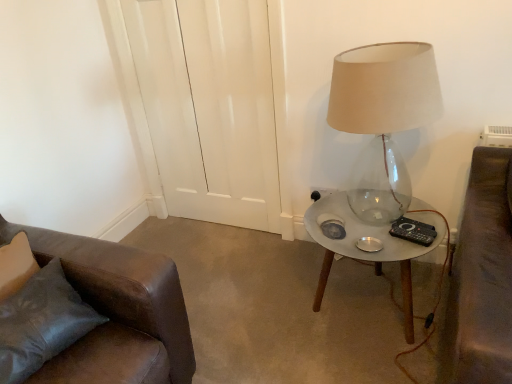
Question: Does black plastic remote control at right have a smaller size compared to black plastic socket at lower right?

Choices:
 (A) no
 (B) yes

Answer: (A)

Question: Is black plastic remote control at right closer to the viewer compared to black plastic socket at lower right?

Choices:
 (A) no
 (B) yes

Answer: (B)

Question: Is black plastic remote control at right not within black plastic socket at lower right?

Choices:
 (A) no
 (B) yes

Answer: (B)

Question: Is black plastic remote control at right next to black plastic socket at lower right and touching it?

Choices:
 (A) no
 (B) yes

Answer: (A)

Question: From the image's perspective, is black plastic remote control at right over black plastic socket at lower right?

Choices:
 (A) no
 (B) yes

Answer: (A)

Question: Considering the relative sizes of black plastic remote control at right and black plastic socket at lower right in the image provided, is black plastic remote control at right taller than black plastic socket at lower right?

Choices:
 (A) yes
 (B) no

Answer: (B)

Question: Is translucent glass lamp at right placed right next to black plastic socket at lower right?

Choices:
 (A) yes
 (B) no

Answer: (B)

Question: Is translucent glass lamp at right bigger than black plastic socket at lower right?

Choices:
 (A) no
 (B) yes

Answer: (B)

Question: Considering the relative sizes of translucent glass lamp at right and black plastic socket at lower right in the image provided, is translucent glass lamp at right wider than black plastic socket at lower right?

Choices:
 (A) no
 (B) yes

Answer: (B)

Question: Considering the relative sizes of translucent glass lamp at right and black plastic socket at lower right in the image provided, is translucent glass lamp at right taller than black plastic socket at lower right?

Choices:
 (A) no
 (B) yes

Answer: (B)

Question: Is black plastic socket at lower right inside translucent glass lamp at right?

Choices:
 (A) yes
 (B) no

Answer: (B)

Question: Is translucent glass lamp at right oriented towards black plastic socket at lower right?

Choices:
 (A) no
 (B) yes

Answer: (A)

Question: Is metallic glass table at right to the left of translucent glass lamp at right from the viewer's perspective?

Choices:
 (A) yes
 (B) no

Answer: (B)